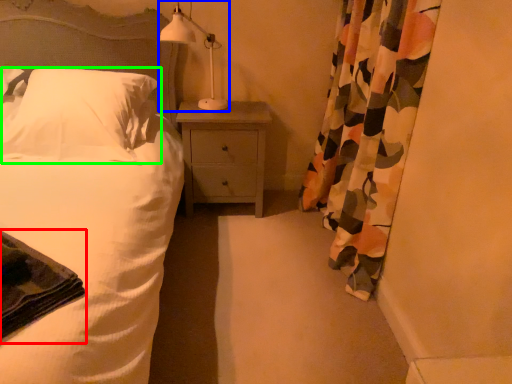
Question: Which object is positioned closest to material (highlighted by a red box)? Select from table lamp (highlighted by a blue box) and pillow (highlighted by a green box).

Choices:
 (A) table lamp
 (B) pillow

Answer: (B)